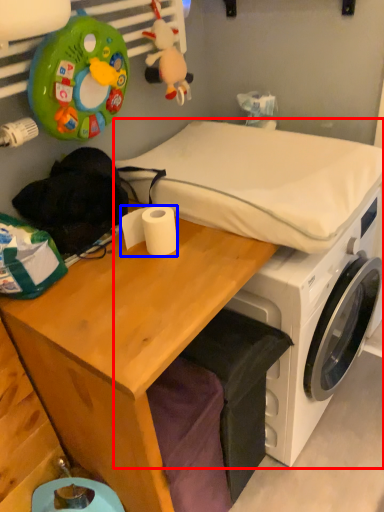
Question: Which object appears closest to the camera in this image, machine (highlighted by a red box) or toilet paper (highlighted by a blue box)?

Choices:
 (A) machine
 (B) toilet paper

Answer: (B)